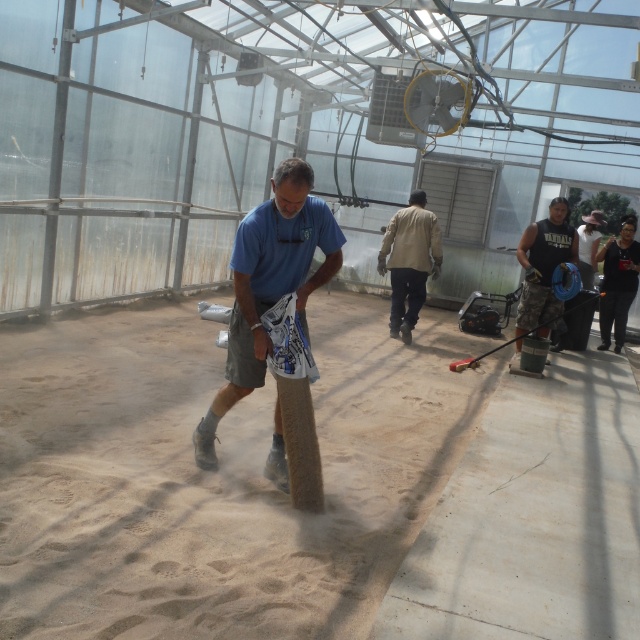
You are standing in the greenhouse and need to reach an object on a high shelf. Which clothing item, the black sleeveless shirt at center or the black leather jacket at right, would be closer to the shelf?

The black leather jacket at right is taller than the black sleeveless shirt at center, so it would be closer to the shelf.

You are a visitor in the greenhouse and want to know which clothing item is bigger between the black sleeveless shirt at center and the black leather jacket at right. Which one is bigger?

The black sleeveless shirt at center is larger in size than the black leather jacket at right.

Based on the scene described, can you determine the position of the smooth concrete floor at center relative to the khaki fabric pants at center?

The smooth concrete floor at center is to the right of the khaki fabric pants at center.